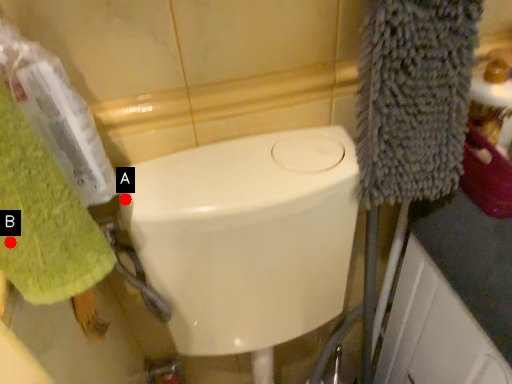
Question: Two points are circled on the image, labeled by A and B beside each circle. Which point is further to the camera?

Choices:
 (A) A is further
 (B) B is further

Answer: (A)